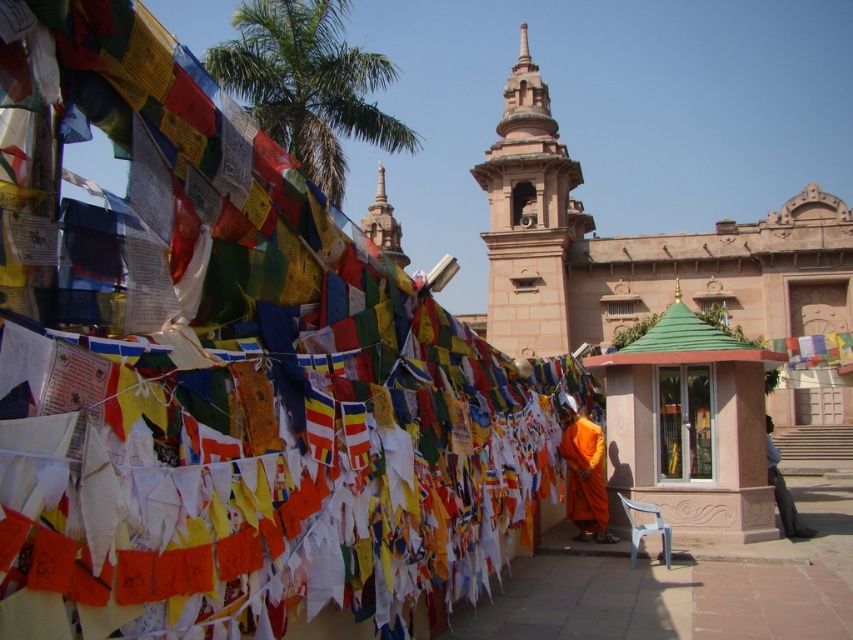
You are a visitor at the temple and want to take a photo of both the orange silk robe at center and the smooth stone stupa at center in the same frame. Your camera has a maximum zoom range of 100 meters. Can you capture both objects in a single photo without moving your position?

The orange silk robe at center and smooth stone stupa at center are 160.94 meters apart. Since your camera can only zoom up to 100 meters, you cannot capture both objects in a single photo without moving your position.